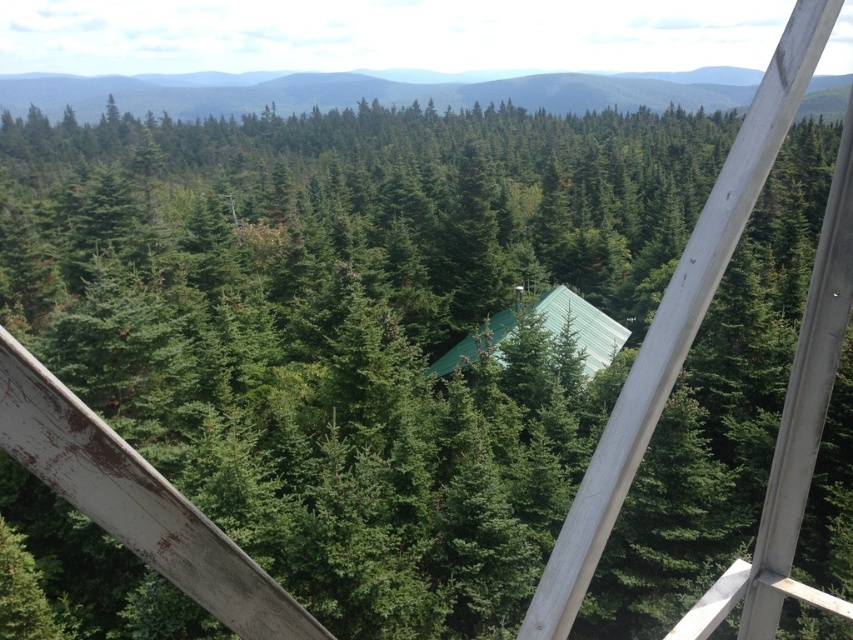
Does green matte forest at upper center appear under green metal cabin at center?

No.

Does green matte forest at upper center have a lesser width compared to green metal cabin at center?

In fact, green matte forest at upper center might be wider than green metal cabin at center.

Between point (503, 97) and point (483, 328), which one is positioned in front?

Point (483, 328) is in front.

You are a GUI agent. You are given a task and a screenshot of the screen. Output one action in this format:
    pyautogui.click(x=<x>, y=<y>)
    Task: Click on the green matte forest at upper center
    
    Given the screenshot: What is the action you would take?
    pyautogui.click(x=372, y=92)